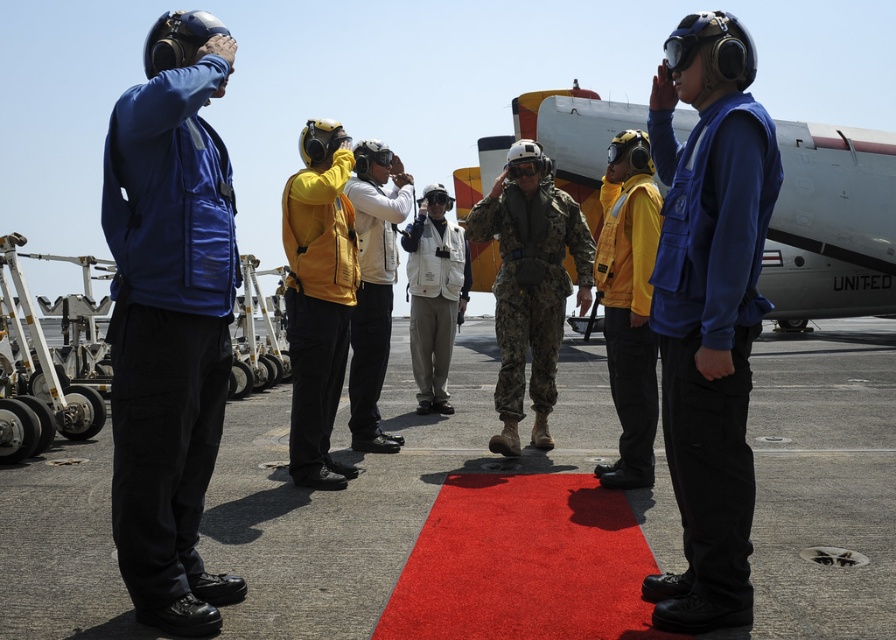
Question: Which object appears closest to the camera in this image?

Choices:
 (A) blue fabric helmet at left
 (B) metallic gray landing gear at left
 (C) camouflage fabric uniform at center
 (D) red carpet at center

Answer: (A)

Question: Among these objects, which one is nearest to the camera?

Choices:
 (A) yellow matte helmet at center
 (B) white matte helmet at center
 (C) white fabric jacket at center
 (D) metallic gray landing gear at left

Answer: (A)

Question: Can you confirm if metallic gray landing gear at left is thinner than white fabric jacket at center?

Choices:
 (A) yes
 (B) no

Answer: (B)

Question: Is red carpet at center above blue fabric vest at center?

Choices:
 (A) yes
 (B) no

Answer: (B)

Question: Can you confirm if red carpet at center is positioned to the left of white matte helmet at center?

Choices:
 (A) yes
 (B) no

Answer: (B)

Question: Which of these objects is positioned farthest from the yellow matte helmet at center?

Choices:
 (A) white fabric jacket at center
 (B) blue fabric vest at center
 (C) white matte helmet at center
 (D) metallic gray landing gear at left

Answer: (A)